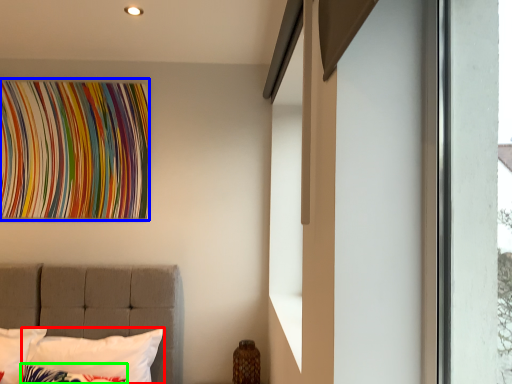
Question: Which object is the closest to the pillow (highlighted by a red box)? Choose among these: tapestry (highlighted by a blue box) or pillow (highlighted by a green box).

Choices:
 (A) tapestry
 (B) pillow

Answer: (B)